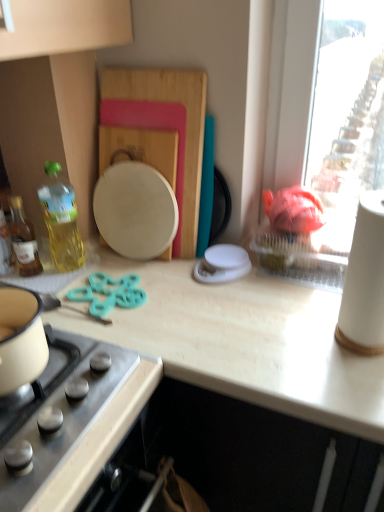
The width and height of the screenshot is (384, 512). In order to click on vacant area that lies between white paper towel at right and translucent yellow bottle at left, the 1th bottle viewed from the right in this screenshot , I will do `click(199, 303)`.